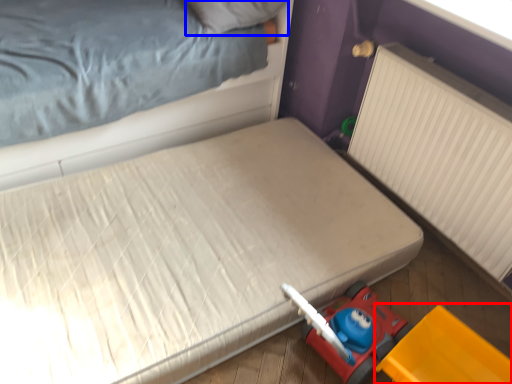
Question: Which object appears farthest to the camera in this image, equipment (highlighted by a red box) or pillow (highlighted by a blue box)?

Choices:
 (A) equipment
 (B) pillow

Answer: (B)